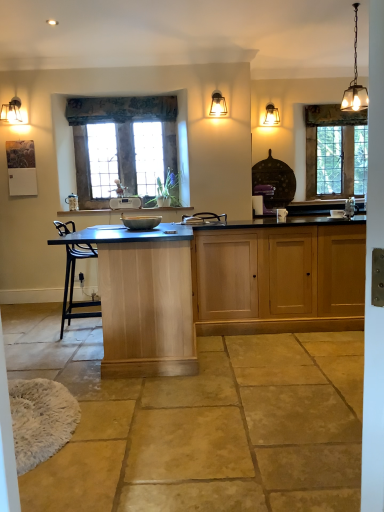
The height and width of the screenshot is (512, 384). What do you see at coordinates (335, 151) in the screenshot?
I see `wooden window at right, the second window in the left-to-right sequence` at bounding box center [335, 151].

Locate an element on the screen. The width and height of the screenshot is (384, 512). wooden window at right, the second window in the left-to-right sequence is located at coordinates (335, 151).

The image size is (384, 512). Find the location of `textured fabric curtain at upper center`. textured fabric curtain at upper center is located at coordinates (121, 109).

What do you see at coordinates (350, 207) in the screenshot?
I see `satin nickel faucet at right` at bounding box center [350, 207].

What do you see at coordinates (218, 105) in the screenshot?
I see `matte glass pendant light at upper center, which is counted as the third light fixture, starting from the right` at bounding box center [218, 105].

Find the location of a particular element. This screenshot has width=384, height=512. light oak cabinet at center is located at coordinates (279, 279).

Which of these two, light wood table at center or light oak cabinet at center, is wider?

Wider between the two is light wood table at center.

From a real-world perspective, who is located higher, light wood table at center or light oak cabinet at center?

From a 3D spatial view, light wood table at center is above.

Find the location of a particular element. Image resolution: width=384 pixels, height=512 pixels. cabinetry behind the light wood table at center is located at coordinates (279, 279).

Is light wood table at center far from light oak cabinet at center?

light wood table at center is near light oak cabinet at center, not far away.

Is textured fabric curtain at upper center aimed at white plastic toaster at center?

No, textured fabric curtain at upper center is not aimed at white plastic toaster at center.

Consider the image. Can we say textured fabric curtain at upper center lies outside white plastic toaster at center?

Yes.

Which of these two, textured fabric curtain at upper center or white plastic toaster at center, stands shorter?

Standing shorter between the two is white plastic toaster at center.

Consider the image. Are matte silver bowl at center and textured fabric curtain at upper center located far from each other?

Yes.

Could you tell me if matte silver bowl at center is facing textured fabric curtain at upper center?

No, matte silver bowl at center does not turn towards textured fabric curtain at upper center.

Which point is more forward, (336,216) or (129,114)?

Positioned in front is point (336,216).

Between white plastic toaster at center and stained glass window at center, arranged as the 2th window when viewed from the back, which one has larger width?

white plastic toaster at center is wider.

How different are the orientations of white plastic toaster at center and stained glass window at center, acting as the 1th window starting from the left, in degrees?

There is a 1.35-degree angle between the facing directions of white plastic toaster at center and stained glass window at center, acting as the 1th window starting from the left.

Is white plastic toaster at center looking in the opposite direction of stained glass window at center, acting as the second window starting from the right?

Absolutely, white plastic toaster at center is directed away from stained glass window at center, acting as the second window starting from the right.

From the image's perspective, would you say white plastic toaster at center is shown under stained glass window at center, arranged as the 2th window when viewed from the back?

Correct, white plastic toaster at center appears lower than stained glass window at center, arranged as the 2th window when viewed from the back, in the image.

Is white plastic toaster at center oriented towards matte glass pendant light at upper center, the 2th light fixture viewed from the front?

No.

Are white plastic toaster at center and matte glass pendant light at upper center, the 1th light fixture when ordered from left to right, far apart?

Yes.

Is point (130, 199) positioned after point (220, 97)?

Yes.

Based on their positions, is white plastic toaster at center located to the left or right of matte glass pendant light at upper center, which is counted as the third light fixture, starting from the right?

Based on their positions, white plastic toaster at center is located to the left of matte glass pendant light at upper center, which is counted as the third light fixture, starting from the right.

Locate an element on the screen. Image resolution: width=384 pixels, height=512 pixels. appliance that is behind the light oak cabinet at center is located at coordinates (125, 203).

From a real-world perspective, is light oak cabinet at center on white plastic toaster at center?

Actually, light oak cabinet at center is physically below white plastic toaster at center in the real world.

Is white plastic toaster at center turned away from light wood table at center?

No, white plastic toaster at center's orientation is not away from light wood table at center.

Can you confirm if white plastic toaster at center is shorter than light wood table at center?

Correct, white plastic toaster at center is not as tall as light wood table at center.

Is white plastic toaster at center to the right of light wood table at center from the viewer's perspective?

No.

Based on the photo, which is closer to the camera, (116, 204) or (148, 325)?

Point (116, 204) is farther from the camera than point (148, 325).

You are a GUI agent. You are given a task and a screenshot of the screen. Output one action in this format:
    pyautogui.click(x=<x>, y=<y>)
    Task: Click on the table that is in front of the light oak cabinet at center
    Image resolution: width=384 pixels, height=512 pixels.
    Given the screenshot: What is the action you would take?
    pyautogui.click(x=144, y=298)

Locate an element on the screen. The height and width of the screenshot is (512, 384). curtain above the white plastic toaster at center (from the image's perspective) is located at coordinates (121, 109).

Looking at this image, estimate the real-world distances between objects in this image. Which object is further from light wood table at center, matte glass pendant light at upper right, which appears as the second light fixture when viewed from the left, or stained glass window at center, acting as the 1th window starting from the left?

matte glass pendant light at upper right, which appears as the second light fixture when viewed from the left, is further to light wood table at center.

From the image, which object appears to be nearer to matte glass pendant light at upper center, which is counted as the third light fixture, starting from the right, matte black lampshade at upper left or stained glass window at center, which appears as the first window when viewed from the front?

stained glass window at center, which appears as the first window when viewed from the front, lies closer to matte glass pendant light at upper center, which is counted as the third light fixture, starting from the right, than the other object.

From the picture: When comparing their distances from satin nickel faucet at right, does light oak cabinet at center or metallic chain-link light fixture at upper right, which ranks as the 3th light fixture in left-to-right order, seem closer?

Among the two, light oak cabinet at center is located nearer to satin nickel faucet at right.

Which object lies nearer to the anchor point metallic chain-link light fixture at upper right, marked as the 3th light fixture in a back-to-front arrangement, matte silver bowl at center or matte glass pendant light at upper center, the 2th light fixture viewed from the front?

matte silver bowl at center lies closer to metallic chain-link light fixture at upper right, marked as the 3th light fixture in a back-to-front arrangement, than the other object.

Which object lies nearer to the anchor point matte silver bowl at center, matte glass pendant light at upper right, the third light fixture in the front-to-back sequence, or stained glass window at center, acting as the 1th window starting from the left?

The object closer to matte silver bowl at center is stained glass window at center, acting as the 1th window starting from the left.

Considering their positions, is light wood table at center positioned further to textured fabric curtain at upper center than stained glass window at center, which appears as the first window when viewed from the front?

light wood table at center is positioned further to the anchor textured fabric curtain at upper center.

Looking at the image, which one is located closer to matte black lampshade at upper left, light wood table at center or metallic chain-link light fixture at upper right, positioned as the first light fixture in right-to-left order?

The object closer to matte black lampshade at upper left is light wood table at center.

Based on their spatial positions, is light wood table at center or wooden window at right, the second window in the left-to-right sequence, further from matte glass pendant light at upper right, the third light fixture in the front-to-back sequence?

light wood table at center.

At what (x,y) coordinates should I click in order to perform the action: click on appliance between matte black lampshade at upper left and metallic chain-link light fixture at upper right, which ranks as the 3th light fixture in left-to-right order, in the horizontal direction. Please return your answer as a coordinate pair (x, y). Looking at the image, I should click on (125, 203).

The height and width of the screenshot is (512, 384). I want to click on table between white plastic toaster at center and metallic chain-link light fixture at upper right, marked as the 3th light fixture in a back-to-front arrangement, in the horizontal direction, so click(144, 298).

The width and height of the screenshot is (384, 512). What are the coordinates of `bowl between light wood table at center and white plastic toaster at center from front to back` in the screenshot? It's located at (337, 213).

Identify the location of light fixture situated between white plastic toaster at center and matte glass pendant light at upper right, the third light fixture in the front-to-back sequence, from left to right. The height and width of the screenshot is (512, 384). [218, 105].